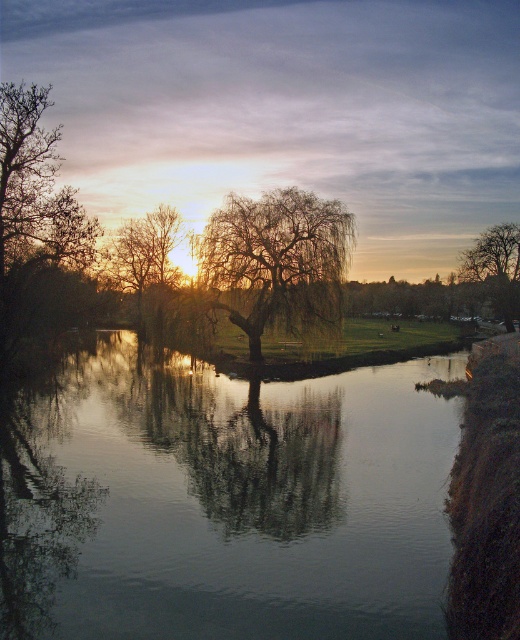
Who is lower down, bare branches at center or brown rough tree at right?

bare branches at center is lower down.

Is point (124, 268) less distant than point (508, 262)?

Yes, it is in front of point (508, 262).

Find the location of a particular element. The image size is (520, 640). bare branches at center is located at coordinates (144, 253).

Is the position of willow tree at center more distant than that of bare branches at center?

No, it is not.

Is willow tree at center thinner than bare branches at center?

Yes.

The image size is (520, 640). In order to click on willow tree at center in this screenshot , I will do `click(278, 260)`.

Between transparent water at center and bare branches at center, which one has less height?

With less height is transparent water at center.

Does point (240, 540) come farther from viewer compared to point (161, 280)?

No, it is in front of (161, 280).

Between point (7, 576) and point (166, 269), which one is positioned behind?

Positioned behind is point (166, 269).

Image resolution: width=520 pixels, height=640 pixels. I want to click on transparent water at center, so click(224, 500).